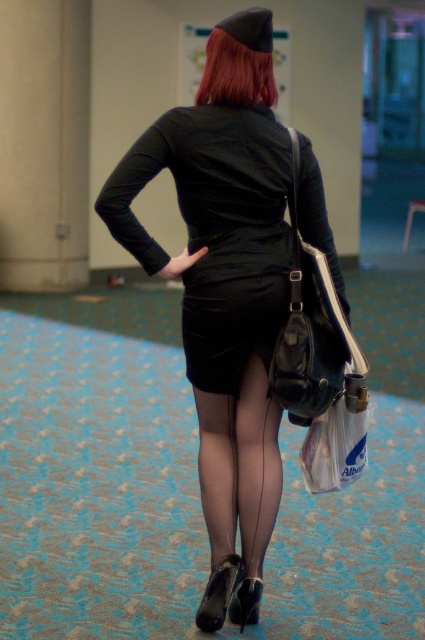
Who is lower down, matte black dress at center or shiny red hair at upper center?

Positioned lower is matte black dress at center.

Can you confirm if matte black dress at center is positioned to the left of shiny red hair at upper center?

Indeed, matte black dress at center is positioned on the left side of shiny red hair at upper center.

Between point (268, 230) and point (235, 97), which one is positioned in front?

Point (235, 97)

At what (x,y) coordinates should I click in order to perform the action: click on matte black dress at center. Please return your answer as a coordinate pair (x, y). Looking at the image, I should click on (223, 316).

Does black satin dress at center appear on the right side of matte black bag at back?

Incorrect, black satin dress at center is not on the right side of matte black bag at back.

Can you confirm if black satin dress at center is thinner than matte black bag at back?

Incorrect, black satin dress at center's width is not less than matte black bag at back's.

Is point (210, 289) behind point (322, 339)?

Yes, it is.

Where is `black satin dress at center`? The height and width of the screenshot is (640, 425). black satin dress at center is located at coordinates (215, 228).

Based on the photo, how far apart are matte black bag at back and translucent plastic bag at lower center?

They are 9.54 inches apart.

Who is shorter, matte black bag at back or translucent plastic bag at lower center?

With less height is translucent plastic bag at lower center.

Locate an element on the screen. matte black bag at back is located at coordinates (308, 326).

You are a GUI agent. You are given a task and a screenshot of the screen. Output one action in this format:
    pyautogui.click(x=<x>, y=<y>)
    Task: Click on the matte black bag at back
    The width and height of the screenshot is (425, 640).
    Given the screenshot: What is the action you would take?
    pyautogui.click(x=308, y=326)